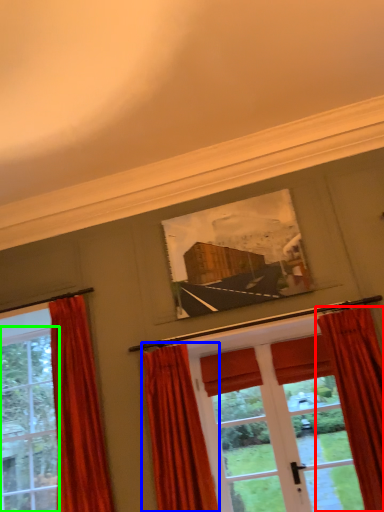
Question: Which object is the closest to the curtain (highlighted by a red box)? Choose among these: curtain (highlighted by a blue box) or window (highlighted by a green box).

Choices:
 (A) curtain
 (B) window

Answer: (A)